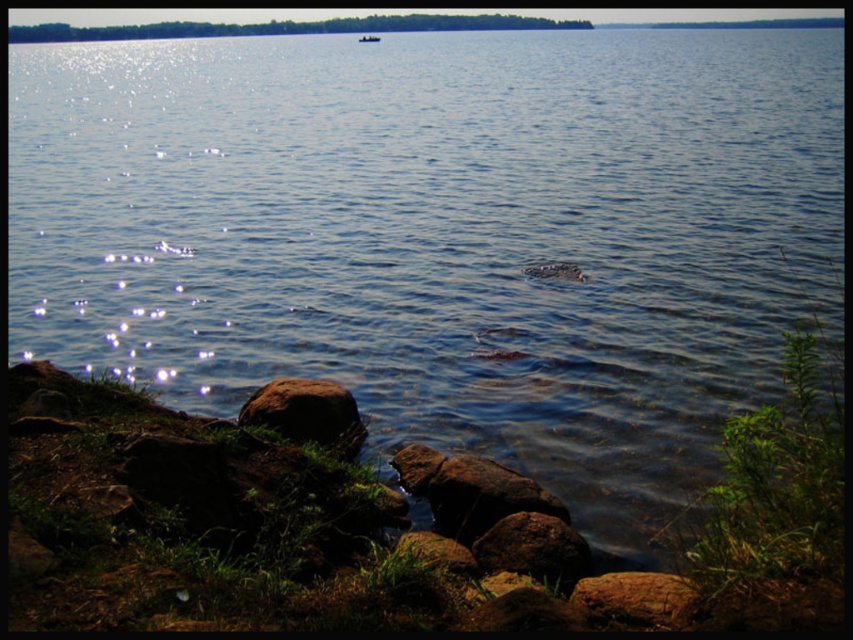
Is brown rough rock at lower center shorter than brown rough rock at lower right?

Indeed, brown rough rock at lower center has a lesser height compared to brown rough rock at lower right.

Who is lower down, brown rough rock at lower center or brown rough rock at lower right?

brown rough rock at lower center is lower down.

Identify the location of brown rough rock at lower center. The width and height of the screenshot is (853, 640). (532, 548).

Does brown rough rock at lower left have a larger size compared to metallic silver boat at upper center?

Incorrect, brown rough rock at lower left is not larger than metallic silver boat at upper center.

Locate an element on the screen. The height and width of the screenshot is (640, 853). brown rough rock at lower left is located at coordinates (306, 413).

Does brown rough rock at lower left appear under brown rough rock at lower right?

Actually, brown rough rock at lower left is above brown rough rock at lower right.

Who is positioned more to the right, brown rough rock at lower left or brown rough rock at lower right?

From the viewer's perspective, brown rough rock at lower right appears more on the right side.

You are a GUI agent. You are given a task and a screenshot of the screen. Output one action in this format:
    pyautogui.click(x=<x>, y=<y>)
    Task: Click on the brown rough rock at lower left
    
    Given the screenshot: What is the action you would take?
    pyautogui.click(x=306, y=413)